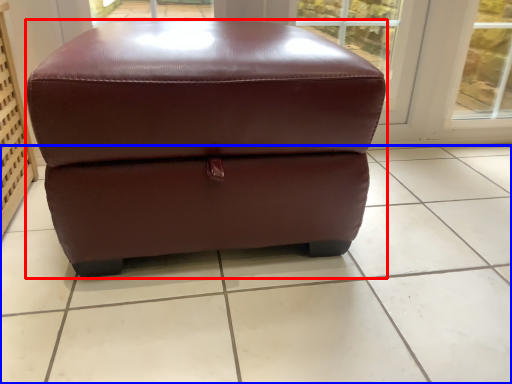
Question: Which object appears closest to the camera in this image, furniture (highlighted by a red box) or tile (highlighted by a blue box)?

Choices:
 (A) furniture
 (B) tile

Answer: (B)